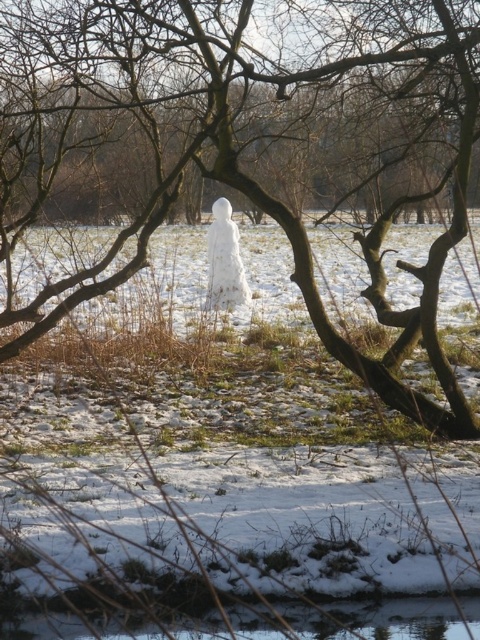
Question: Among these points, which one is nearest to the camera?

Choices:
 (A) (22, 108)
 (B) (237, 260)

Answer: (A)

Question: Does white snowman at center have a smaller size compared to white fluffy snowman at center?

Choices:
 (A) yes
 (B) no

Answer: (B)

Question: Which point is closer to the camera taking this photo?

Choices:
 (A) (212, 45)
 (B) (238, 264)

Answer: (A)

Question: In this image, where is white snowman at center located relative to white fluffy snowman at center?

Choices:
 (A) above
 (B) below

Answer: (A)

Question: Which point appears farthest from the camera in this image?

Choices:
 (A) (248, 301)
 (B) (21, 100)

Answer: (A)

Question: Does white snowman at center appear over white fluffy snowman at center?

Choices:
 (A) yes
 (B) no

Answer: (A)